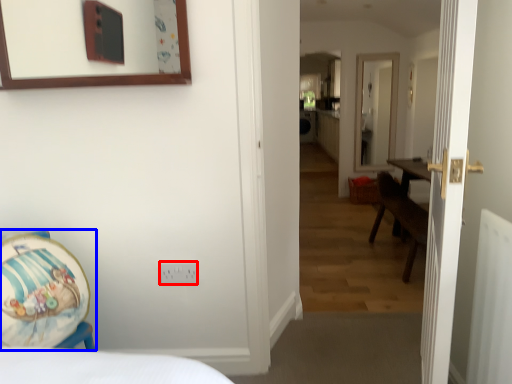
Question: Which point is further to the camera, electric outlet (highlighted by a red box) or armchair (highlighted by a blue box)?

Choices:
 (A) electric outlet
 (B) armchair

Answer: (A)